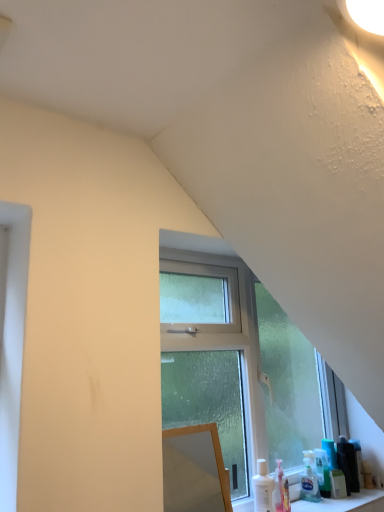
Question: Considering the positions of matte black hairbrush at lower right, the first toiletry viewed from the right, and green plastic bottle at lower right, which is the third toiletry from left to right, in the image, is matte black hairbrush at lower right, the first toiletry viewed from the right, taller or shorter than green plastic bottle at lower right, which is the third toiletry from left to right,?

Choices:
 (A) tall
 (B) short

Answer: (B)

Question: Which is correct: matte black hairbrush at lower right, the first toiletry viewed from the right, is inside green plastic bottle at lower right, which is the third toiletry from left to right, or outside of it?

Choices:
 (A) inside
 (B) outside

Answer: (B)

Question: Which of these objects is positioned farthest from the wooden mirror at center?

Choices:
 (A) clear glass window at center
 (B) green plastic bottle at lower right, which is the third toiletry from left to right
 (C) matte black hairbrush at lower right, positioned as the 4th toiletry in left-to-right order
 (D) translucent plastic soap dispenser at lower right, which is counted as the 3th toiletry, starting from the right
 (E) translucent plastic soap dispenser at lower right, acting as the fourth toiletry starting from the right

Answer: (C)

Question: Estimate the real-world distances between objects in this image. Which object is farther from the translucent plastic soap dispenser at lower right, the 2th toiletry in the left-to-right sequence?

Choices:
 (A) green plastic bottle at lower right, which is the third toiletry from left to right
 (B) clear glass window at center
 (C) wooden mirror at center
 (D) matte black hairbrush at lower right, the first toiletry viewed from the right
 (E) translucent plastic soap dispenser at lower right, the 1th toiletry viewed from the left

Answer: (C)